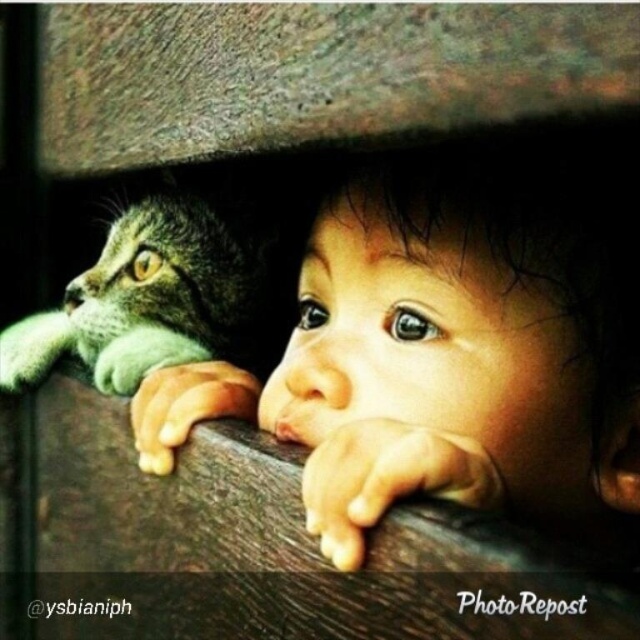
Can you confirm if smooth skin baby at center is positioned above tabby fur cat at left?

No.

Describe the element at coordinates (468, 342) in the screenshot. I see `smooth skin baby at center` at that location.

Does point (456, 476) come in front of point (212, 218)?

Yes, point (456, 476) is in front of point (212, 218).

You are a GUI agent. You are given a task and a screenshot of the screen. Output one action in this format:
    pyautogui.click(x=<x>, y=<y>)
    Task: Click on the smooth skin baby at center
    Image resolution: width=640 pixels, height=640 pixels.
    Given the screenshot: What is the action you would take?
    pos(468,342)